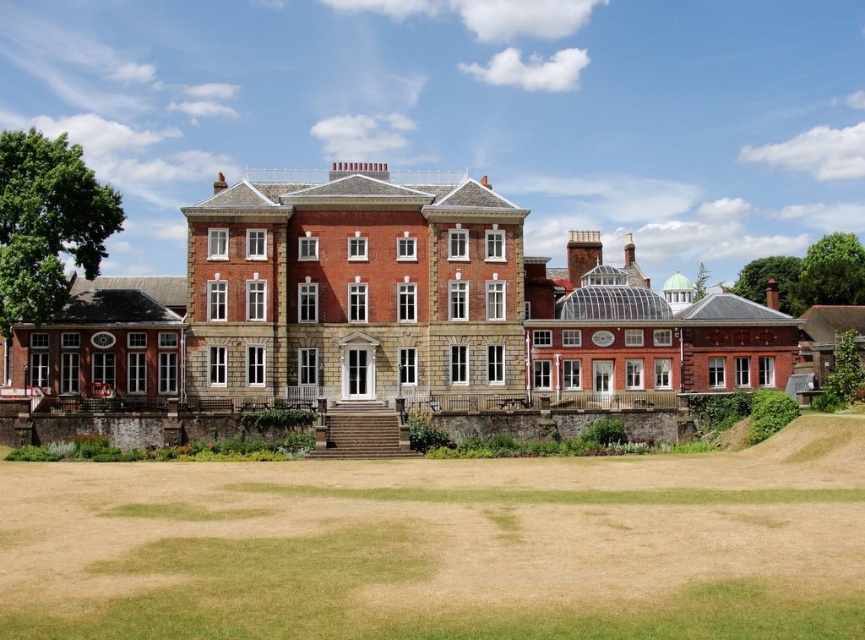
Which is in front, point (834, 524) or point (677, 376)?

Positioned in front is point (834, 524).

Which is below, brown grass at lower center or brick stone mansion at center?

brown grass at lower center is below.

This screenshot has height=640, width=865. Find the location of `brown grass at lower center`. brown grass at lower center is located at coordinates (444, 545).